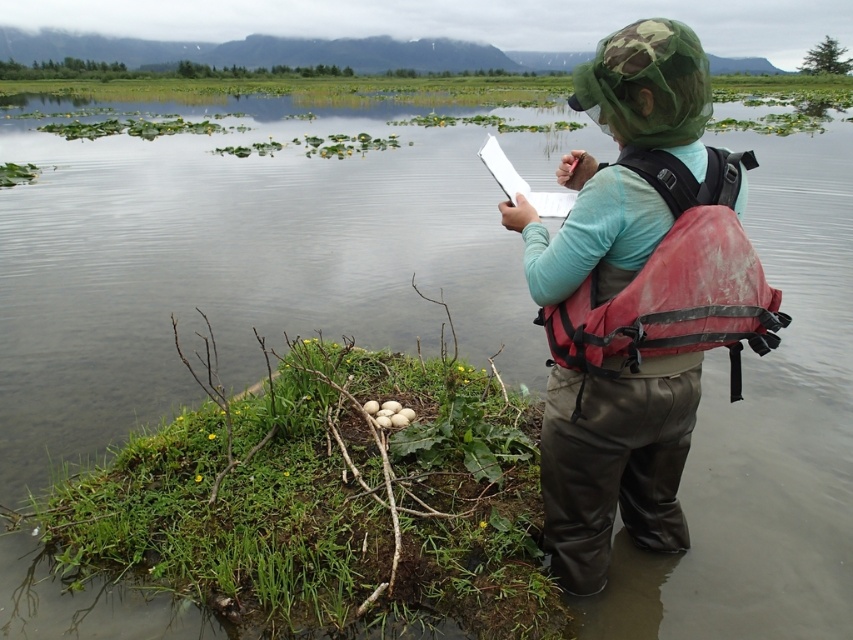
You are a drone operator tasked with capturing a photo of the person in the scene. The camera is positioned at the origin point. The matte green hat at upper center is at coordinates point 0.722, 0.722. To ensure the hat is centered in the photo, should you adjust the camera upwards or downwards?

The matte green hat at upper center is located at point (614,461). Since the coordinates are both 0.722, which is above the center point of the image, the camera should be adjusted downwards to center the hat.

You are a hiker who needs to know which object is taller between the matte green hat at upper center and the red nylon life jacket at back. Based on the scene, which one is taller?

The matte green hat at upper center is much taller than the red nylon life jacket at back.

Based on the photo, you are a hiker planning to cross the marsh. You notice the matte green hat at upper center and the red nylon life jacket at back. Which item is wider when viewed from above?

The matte green hat at upper center is wider than the red nylon life jacket at back.